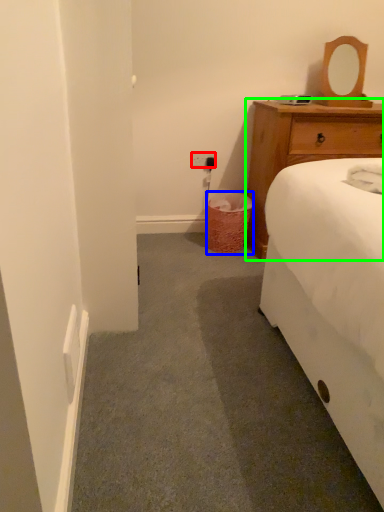
Question: Based on their relative distances, which object is farther from power outlet (highlighted by a red box)? Choose from trash bin/can (highlighted by a blue box) and chest of drawers (highlighted by a green box).

Choices:
 (A) trash bin/can
 (B) chest of drawers

Answer: (B)